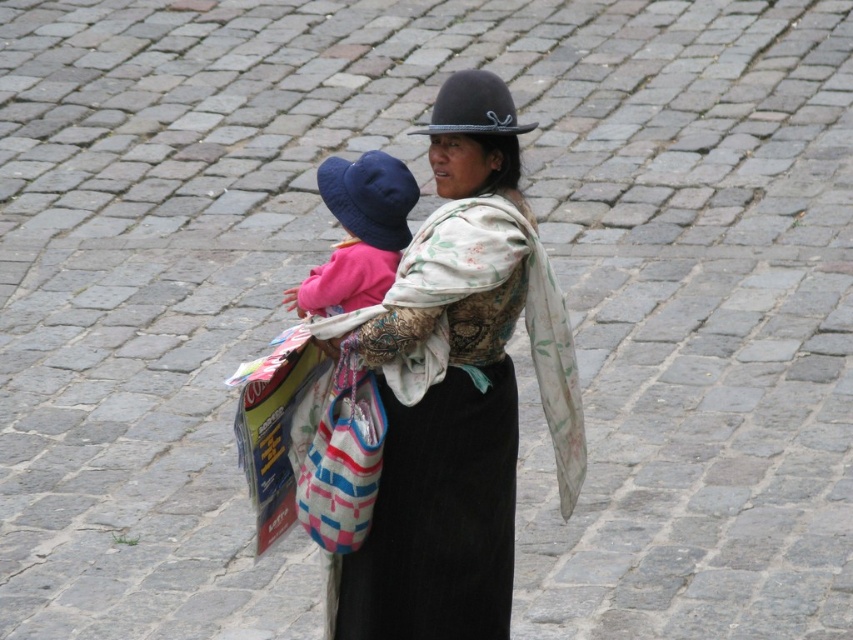
Question: Can you confirm if matte blue fabric hat at upper center is positioned to the left of navy blue fabric hat at upper center?

Choices:
 (A) yes
 (B) no

Answer: (A)

Question: Which of the following is the closest to the observer?

Choices:
 (A) black felt hat at center
 (B) navy blue fabric hat at upper center
 (C) matte blue fabric hat at upper center
 (D) matte black hat at center

Answer: (A)

Question: Which is nearer to the black felt hat at center?

Choices:
 (A) matte blue fabric hat at upper center
 (B) matte black hat at center
 (C) navy blue fabric hat at upper center

Answer: (B)

Question: Is matte black hat at center closer to the viewer compared to black felt hat at center?

Choices:
 (A) yes
 (B) no

Answer: (B)

Question: Which of these objects is positioned closest to the matte blue fabric hat at upper center?

Choices:
 (A) matte black hat at center
 (B) navy blue fabric hat at upper center

Answer: (B)

Question: Considering the relative positions of navy blue fabric hat at upper center and black felt hat at center in the image provided, where is navy blue fabric hat at upper center located with respect to black felt hat at center?

Choices:
 (A) below
 (B) above

Answer: (A)